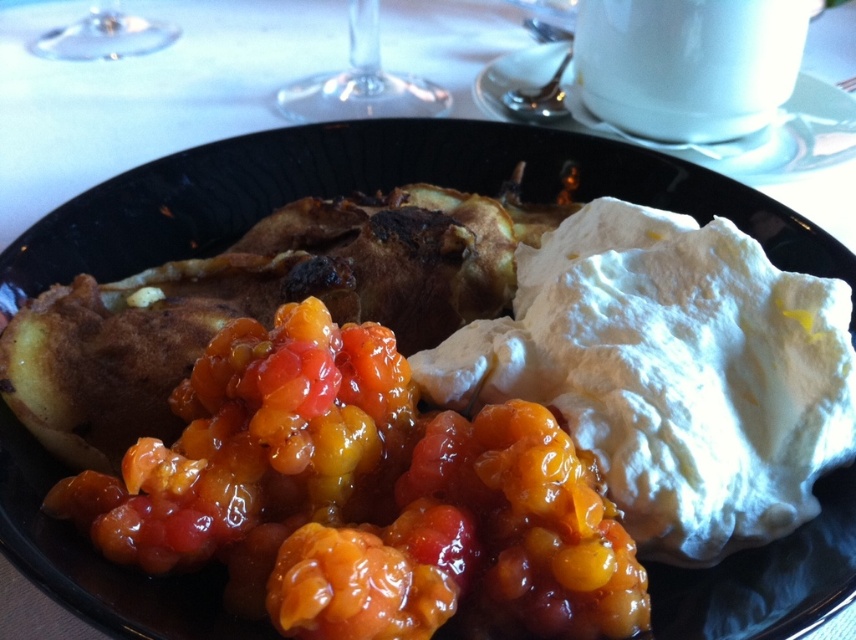
You are a bartender preparing a drink and need to choose between the transparent glass at upper center and the transparent glass at upper left. Which glass has a wider opening?

The transparent glass at upper center has a wider opening than the transparent glass at upper left because its width is larger according to the description.

From the picture: You are a food stylist arranging a dessert photo shoot. You have a glistening orange jam at center and a transparent glass at upper left. According to the image, which object is more to the left?

The transparent glass at upper left is more to the left because the glistening orange jam at center is positioned on the right side of it.

You are a food critic evaluating the dessert plate. You notice two points on the plate. The first point is at coordinate (526, 520) and the second is at (348, 28). Which point is closer to you?

Point (526, 520) is closer to the viewer than point (348, 28).